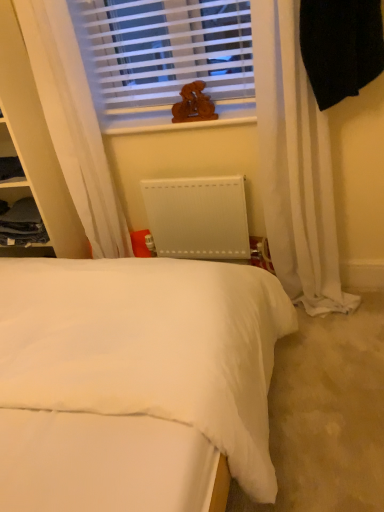
Question: Can you confirm if dark gray fabric cabinet at left is bigger than white sheer curtain at upper left?

Choices:
 (A) no
 (B) yes

Answer: (A)

Question: Is dark gray fabric cabinet at left thinner than white sheer curtain at upper left?

Choices:
 (A) yes
 (B) no

Answer: (A)

Question: From the image's perspective, is dark gray fabric cabinet at left over white sheer curtain at upper left?

Choices:
 (A) no
 (B) yes

Answer: (A)

Question: Considering the relative sizes of dark gray fabric cabinet at left and white sheer curtain at upper left in the image provided, is dark gray fabric cabinet at left shorter than white sheer curtain at upper left?

Choices:
 (A) no
 (B) yes

Answer: (B)

Question: Is dark gray fabric cabinet at left far from white sheer curtain at upper left?

Choices:
 (A) yes
 (B) no

Answer: (B)

Question: Considering the positions of white soft bed at center and white matte radiator at center in the image, is white soft bed at center wider or thinner than white matte radiator at center?

Choices:
 (A) wide
 (B) thin

Answer: (A)

Question: Considering the positions of white soft bed at center and white matte radiator at center in the image, is white soft bed at center bigger or smaller than white matte radiator at center?

Choices:
 (A) small
 (B) big

Answer: (B)

Question: Is white soft bed at center spatially inside white matte radiator at center, or outside of it?

Choices:
 (A) outside
 (B) inside

Answer: (A)

Question: From the image's perspective, is white soft bed at center positioned above or below white matte radiator at center?

Choices:
 (A) above
 (B) below

Answer: (B)

Question: Based on their positions, is white plastic blinds at upper center located to the left or right of white sheer curtain at upper left?

Choices:
 (A) right
 (B) left

Answer: (A)

Question: From a real-world perspective, relative to white sheer curtain at upper left, is white plastic blinds at upper center vertically above or below?

Choices:
 (A) below
 (B) above

Answer: (B)

Question: Is white plastic blinds at upper center bigger or smaller than white sheer curtain at upper left?

Choices:
 (A) small
 (B) big

Answer: (A)

Question: In the image, is white plastic blinds at upper center positioned in front of or behind white sheer curtain at upper left?

Choices:
 (A) behind
 (B) front

Answer: (A)

Question: Looking at the image, does white sheer curtain at upper left seem bigger or smaller compared to white plastic blinds at upper center?

Choices:
 (A) big
 (B) small

Answer: (A)

Question: Is point (82, 202) closer or farther from the camera than point (223, 20)?

Choices:
 (A) farther
 (B) closer

Answer: (A)